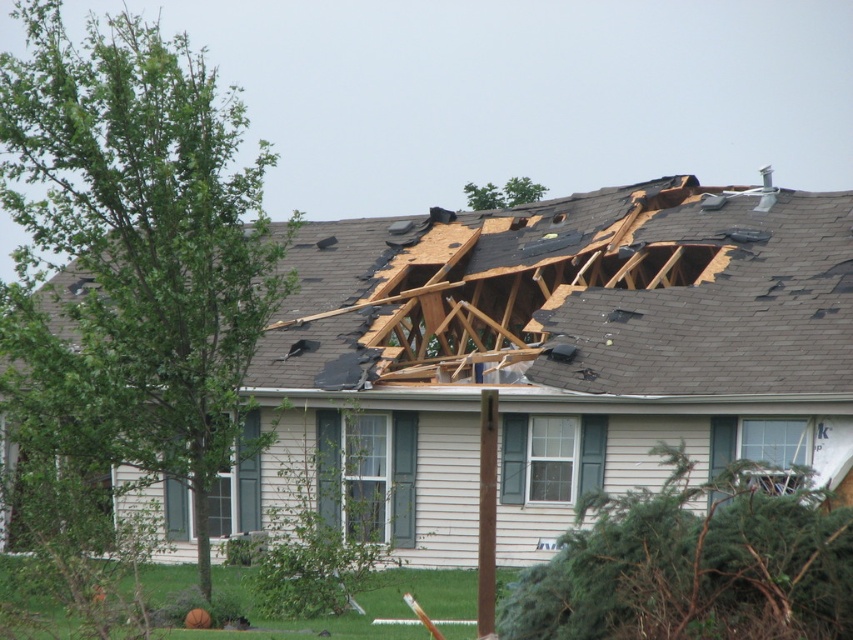
You are an inspector assessing the damage to the house. You notice the shiny gray shingles at upper center and the brown wood pole at center. Which object is higher in the image?

The shiny gray shingles at upper center are higher in the image than the brown wood pole at center.

You are an inspector assessing the damage to the house. You notice the shiny gray shingles at upper center and the brown wood pole at center. Which object would you prioritize inspecting first based on their size and potential structural impact?

The shiny gray shingles at upper center should be prioritized for inspection first because they are larger in size than the brown wood pole at center, indicating a more significant structural concern.